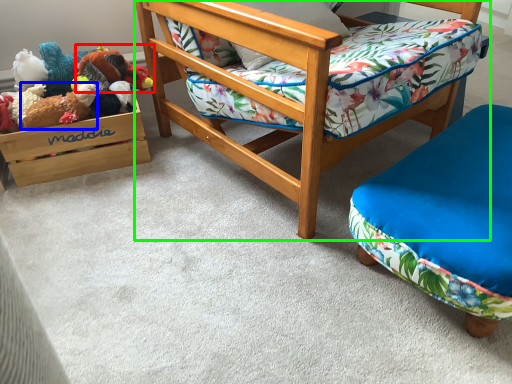
Question: Considering the real-world distances, which object is farthest from toy (highlighted by a red box)? toy (highlighted by a blue box) or chair (highlighted by a green box)?

Choices:
 (A) toy
 (B) chair

Answer: (B)